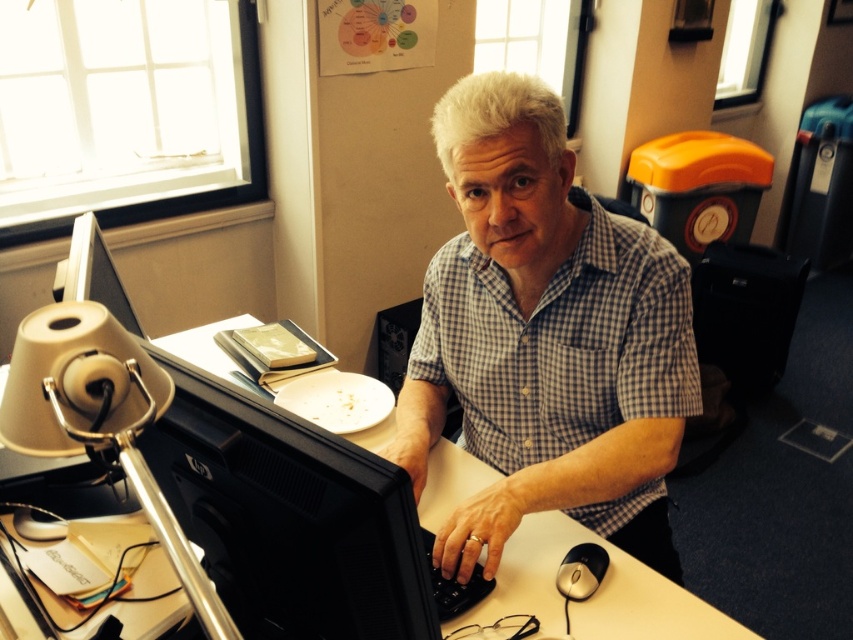
Question: Is black plastic monitor at center bigger than matte black monitor at center?

Choices:
 (A) yes
 (B) no

Answer: (B)

Question: Which of these objects is positioned farthest from the black plastic keyboard at center?

Choices:
 (A) matte black monitor at center
 (B) checkered fabric shirt at center
 (C) black plastic monitor at center
 (D) black glossy monitor at left

Answer: (D)

Question: Which point is closer to the camera?

Choices:
 (A) (502, 557)
 (B) (602, 561)

Answer: (B)

Question: Can you confirm if checkered fabric shirt at center is positioned below black plastic mouse at lower right?

Choices:
 (A) no
 (B) yes

Answer: (A)

Question: Does checkered fabric shirt at center come in front of matte black monitor at center?

Choices:
 (A) yes
 (B) no

Answer: (B)

Question: Among these points, which one is nearest to the camera?

Choices:
 (A) (577, 572)
 (B) (618, 557)
 (C) (337, 528)

Answer: (C)